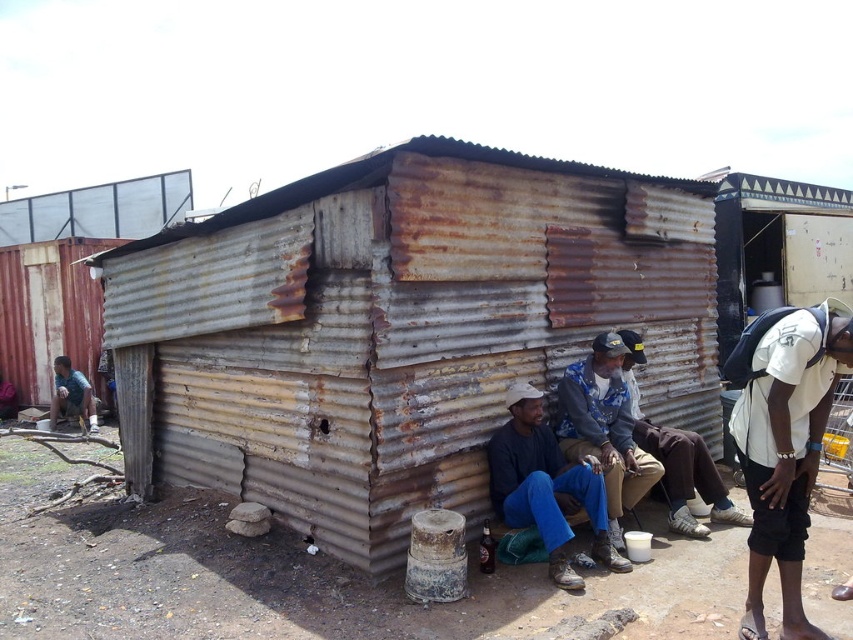
This screenshot has height=640, width=853. Describe the element at coordinates (604, 428) in the screenshot. I see `blue denim pants at center` at that location.

Can you confirm if blue denim pants at center is positioned to the right of dark blue jeans at center?

In fact, blue denim pants at center is to the left of dark blue jeans at center.

Is point (616, 339) farther from camera compared to point (669, 516)?

Yes, it is behind point (669, 516).

Find the location of a particular element. blue denim pants at center is located at coordinates (604, 428).

Who is more distant from viewer, [753,614] or [827,228]?

Point [827,228]

Describe the element at coordinates (784, 442) in the screenshot. I see `white fabric backpack at right` at that location.

Image resolution: width=853 pixels, height=640 pixels. I want to click on white fabric backpack at right, so click(784, 442).

This screenshot has width=853, height=640. What do you see at coordinates (776, 246) in the screenshot? I see `rusty corrugated metal hut at upper right` at bounding box center [776, 246].

Can you confirm if rusty corrugated metal hut at upper right is wider than blue denim pants at center?

Correct, the width of rusty corrugated metal hut at upper right exceeds that of blue denim pants at center.

The height and width of the screenshot is (640, 853). What do you see at coordinates (776, 246) in the screenshot?
I see `rusty corrugated metal hut at upper right` at bounding box center [776, 246].

Where is `rusty corrugated metal hut at upper right`? This screenshot has width=853, height=640. rusty corrugated metal hut at upper right is located at coordinates (776, 246).